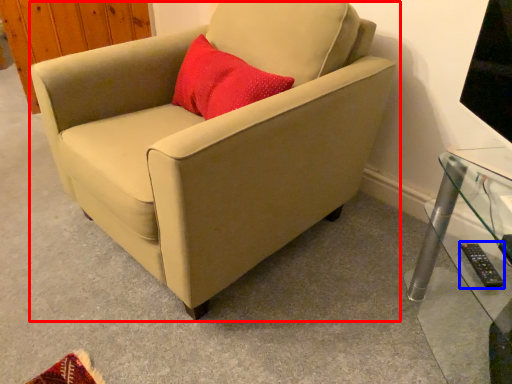
Question: Which object appears closest to the camera in this image, chair (highlighted by a red box) or remote (highlighted by a blue box)?

Choices:
 (A) chair
 (B) remote

Answer: (A)